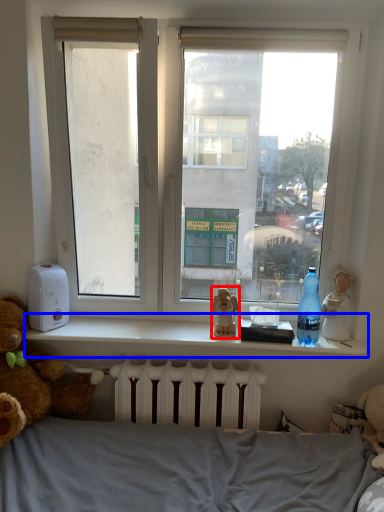
Question: Which of the following is the closest to the observer, figurine (highlighted by a red box) or window sill (highlighted by a blue box)?

Choices:
 (A) figurine
 (B) window sill

Answer: (B)